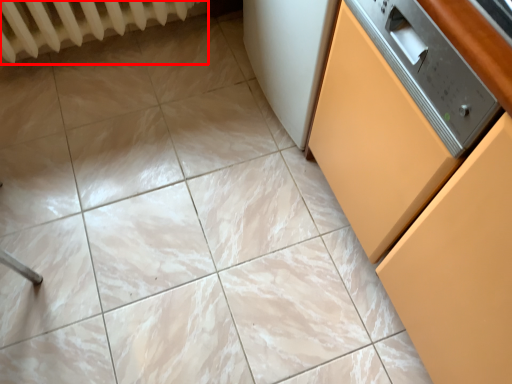
Question: Observing the image, what is the correct spatial positioning of radiator (annotated by the red box) in reference to cabinetry?

Choices:
 (A) right
 (B) left

Answer: (B)